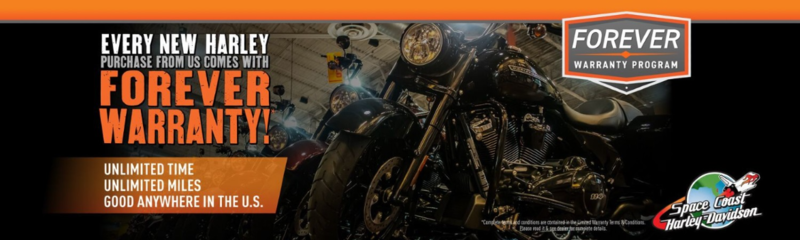
Locate an element on the screen. This screenshot has width=800, height=240. seat is located at coordinates (598, 110).